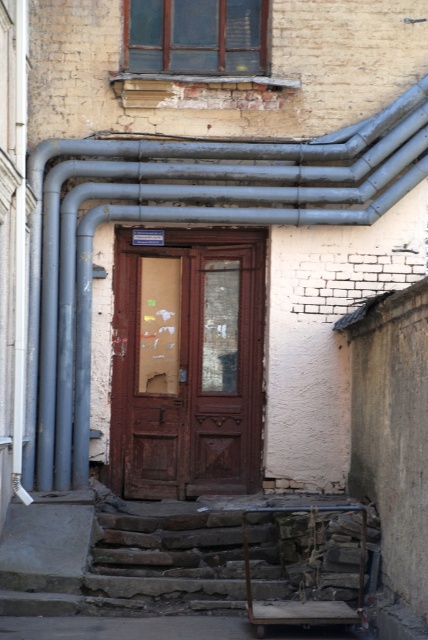
You are a painter who needs to assess the space between the metallic gray pipes at upper left and the brown wooden door at center. Can you determine if the pipes are wider than the door?

The metallic gray pipes at upper left might be wider than brown wooden door at center according to the description.

You are a painter standing in front of the brown wooden door at center and want to paint the metallic gray pipes at upper left. Since you have a ladder that can reach 2 meters, can you paint the pipes without moving the ladder closer to the pipes?

The metallic gray pipes at upper left are closer to the viewer than the brown wooden door at center, so they are within reach of your ladder. Therefore, you can paint the metallic gray pipes at upper left without needing to move the ladder closer.

You are a painter hired to paint the walls in the scene. You have a ladder that can reach up to 2 meters. The metallic gray pipes at upper left and the brown wooden door at center are both in your line of sight. Can you reach both objects with your ladder?

The metallic gray pipes at upper left is larger in size than brown wooden door at center. Since the ladder can reach up to 2 meters, you can reach both objects if they are within that height range. However, the size comparison between the objects does not directly indicate their height from the ground. Please check their actual heights to confirm reachability.